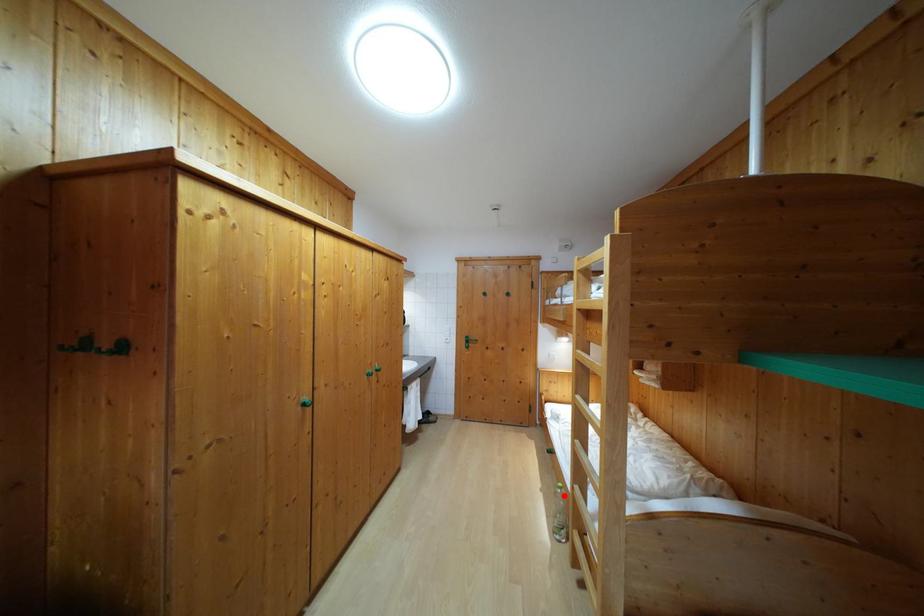
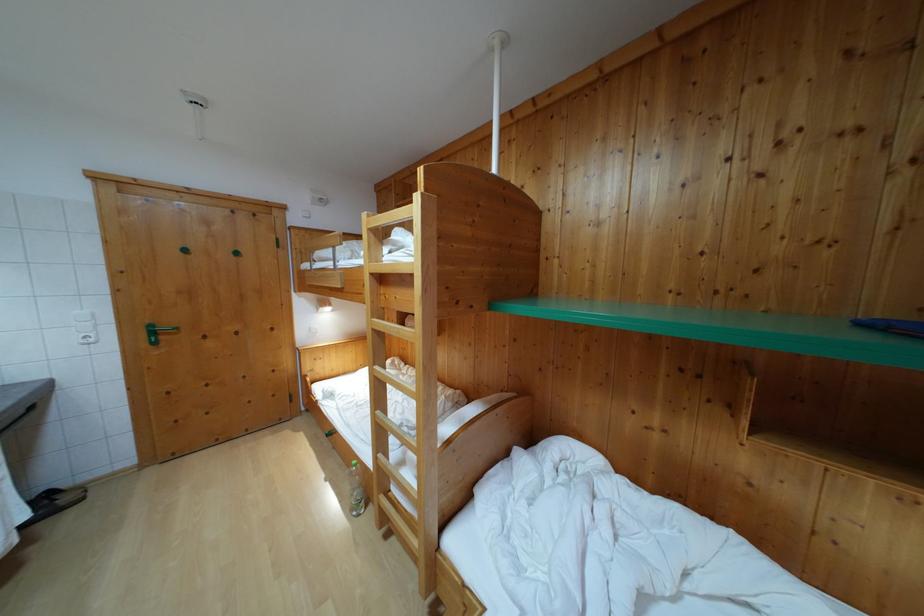
Question: I am providing you with two images of the same scene from different viewpoints. A red point is shown in image1. For the corresponding object point in image2, is it positioned nearer or farther from the camera?

Choices:
 (A) Nearer
 (B) Farther

Answer: (B)